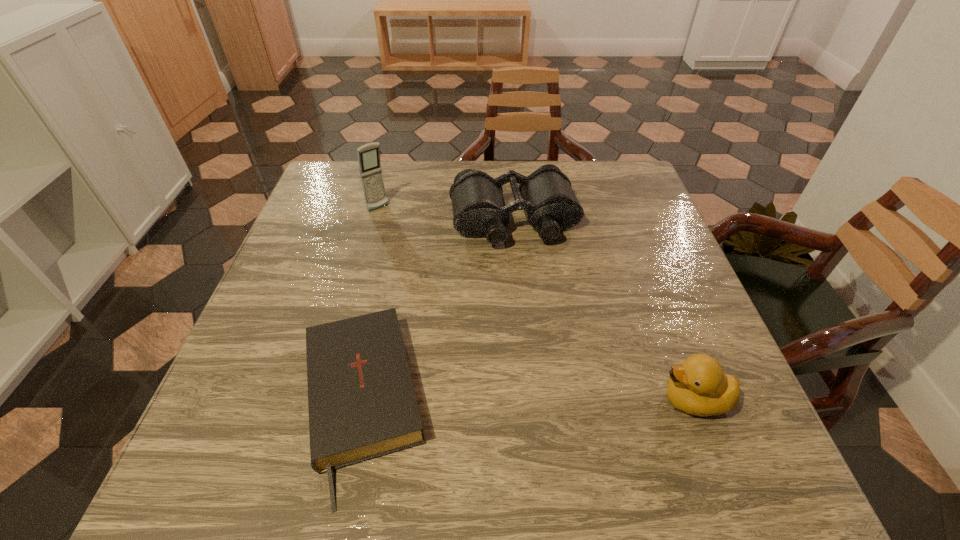
I want to click on vacant region that satisfies the following two spatial constraints: 1. on the front side of the binoculars; 2. on the left side of the cellular telephone, so click(x=375, y=220).

You are a GUI agent. You are given a task and a screenshot of the screen. Output one action in this format:
    pyautogui.click(x=<x>, y=<y>)
    Task: Click on the free spot that satisfies the following two spatial constraints: 1. on the back side of the shortest object; 2. facing forward on the rightmost object
    The width and height of the screenshot is (960, 540).
    Given the screenshot: What is the action you would take?
    pyautogui.click(x=361, y=400)

Locate an element on the screen. This screenshot has width=960, height=540. free space that satisfies the following two spatial constraints: 1. on the back side of the rightmost object; 2. facing forward on the Bible is located at coordinates (361, 400).